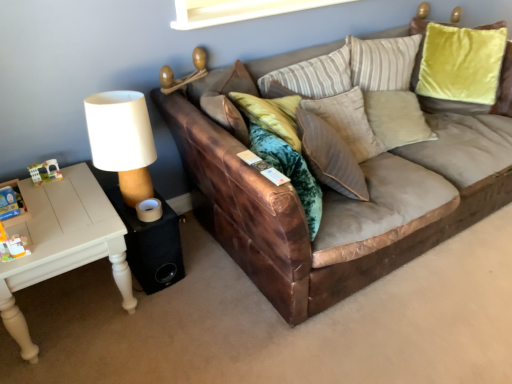
At what (x,y) coordinates should I click in order to perform the action: click on black fabric speaker at lower left. Please return your answer as a coordinate pair (x, y). Image resolution: width=512 pixels, height=384 pixels. Looking at the image, I should click on (151, 244).

Describe the element at coordinates (151, 244) in the screenshot. I see `black fabric speaker at lower left` at that location.

Image resolution: width=512 pixels, height=384 pixels. What do you see at coordinates (62, 243) in the screenshot?
I see `white painted wood table at left` at bounding box center [62, 243].

What is the approximate width of brown leather couch at center?

The width of brown leather couch at center is 1.09 meters.

The height and width of the screenshot is (384, 512). I want to click on black fabric speaker at lower left, so click(151, 244).

From a real-world perspective, is suede-like beige pillow at center located beneath brown leather couch at center?

No, from a real-world perspective, suede-like beige pillow at center is not under brown leather couch at center.

Is suede-like beige pillow at center bigger or smaller than brown leather couch at center?

Considering their sizes, suede-like beige pillow at center takes up less space than brown leather couch at center.

Are suede-like beige pillow at center and brown leather couch at center located far from each other?

They are positioned close to each other.

Locate an element on the screen. The image size is (512, 384). studio couch that appears in front of the suede-like beige pillow at center is located at coordinates (331, 206).

Is black fabric speaker at lower left thinner than white painted wood table at left?

Indeed, black fabric speaker at lower left has a lesser width compared to white painted wood table at left.

Which object is further away from the camera taking this photo, black fabric speaker at lower left or white painted wood table at left?

black fabric speaker at lower left.

From the image's perspective, which one is positioned lower, black fabric speaker at lower left or white painted wood table at left?

From the image's view, white painted wood table at left is below.

Based on the photo, between black fabric speaker at lower left and white painted wood table at left, which one has less height?

With less height is black fabric speaker at lower left.

Is point (301, 124) closer or farther from the camera than point (177, 279)?

Clearly, point (301, 124) is closer to the camera than point (177, 279).

Does suede-like beige pillow at center touch black fabric speaker at lower left?

No, suede-like beige pillow at center is not touching black fabric speaker at lower left.

Is suede-like beige pillow at center positioned with its back to black fabric speaker at lower left?

That's right, suede-like beige pillow at center is facing away from black fabric speaker at lower left.

From a real-world perspective, is suede-like beige pillow at center physically located above or below black fabric speaker at lower left?

Clearly, from a real-world perspective, suede-like beige pillow at center is above black fabric speaker at lower left.

Is suede-like beige pillow at center outside of white painted wood table at left?

That's correct, suede-like beige pillow at center is outside of white painted wood table at left.

Which is more to the right, suede-like beige pillow at center or white painted wood table at left?

suede-like beige pillow at center.

Is suede-like beige pillow at center positioned behind white painted wood table at left?

Yes, suede-like beige pillow at center is behind white painted wood table at left.

Could you tell me if suede-like beige pillow at center is turned towards white painted wood table at left?

No, suede-like beige pillow at center is not facing towards white painted wood table at left.

Is black fabric speaker at lower left surrounded by brown leather couch at center?

No, brown leather couch at center does not contain black fabric speaker at lower left.

Is point (496, 188) behind point (182, 258)?

Yes, point (496, 188) is farther from viewer.

Is brown leather couch at center oriented towards black fabric speaker at lower left?

No, brown leather couch at center is not turned towards black fabric speaker at lower left.

Which object is wider, brown leather couch at center or black fabric speaker at lower left?

With larger width is brown leather couch at center.

From the picture: From the image's perspective, does brown leather couch at center appear higher than suede-like beige pillow at center?

Yes, from the image's perspective, brown leather couch at center is above suede-like beige pillow at center.

Does brown leather couch at center have a greater height compared to suede-like beige pillow at center?

Correct, brown leather couch at center is much taller as suede-like beige pillow at center.

Is brown leather couch at center in contact with suede-like beige pillow at center?

No.

Where is `pillow behind the brown leather couch at center`? The width and height of the screenshot is (512, 384). pillow behind the brown leather couch at center is located at coordinates (330, 157).

Would you say white painted wood table at left is outside brown leather couch at center?

Yes, white painted wood table at left is located beyond the bounds of brown leather couch at center.

Is white painted wood table at left to the right of brown leather couch at center from the viewer's perspective?

In fact, white painted wood table at left is to the left of brown leather couch at center.

Is white painted wood table at left oriented towards brown leather couch at center?

No, white painted wood table at left is not facing towards brown leather couch at center.

Considering the relative sizes of white painted wood table at left and brown leather couch at center in the image provided, is white painted wood table at left smaller than brown leather couch at center?

Yes.

Identify the location of pillow on the left of brown leather couch at center. The height and width of the screenshot is (384, 512). (330, 157).

Locate an element on the screen. The height and width of the screenshot is (384, 512). side table that appears above the white painted wood table at left (from the image's perspective) is located at coordinates (151, 244).

From the image, which object appears to be nearer to black fabric speaker at lower left, white painted wood table at left or suede-like beige pillow at center?

The object closer to black fabric speaker at lower left is white painted wood table at left.

Considering their positions, is white painted wood table at left positioned closer to suede-like beige pillow at center than brown leather couch at center?

brown leather couch at center is closer to suede-like beige pillow at center.

Considering their positions, is suede-like beige pillow at center positioned closer to black fabric speaker at lower left than white painted wood table at left?

Among the two, white painted wood table at left is located nearer to black fabric speaker at lower left.

Considering their positions, is white painted wood table at left positioned closer to suede-like beige pillow at center than black fabric speaker at lower left?

Based on the image, black fabric speaker at lower left appears to be nearer to suede-like beige pillow at center.

When comparing their distances from suede-like beige pillow at center, does brown leather couch at center or white painted wood table at left seem closer?

The object closer to suede-like beige pillow at center is brown leather couch at center.

Based on the photo, considering their positions, is black fabric speaker at lower left positioned closer to white painted wood table at left than brown leather couch at center?

black fabric speaker at lower left lies closer to white painted wood table at left than the other object.

Considering their positions, is white painted wood table at left positioned closer to black fabric speaker at lower left than brown leather couch at center?

white painted wood table at left lies closer to black fabric speaker at lower left than the other object.

Looking at the image, which one is located further to white painted wood table at left, brown leather couch at center or black fabric speaker at lower left?

brown leather couch at center is positioned further to the anchor white painted wood table at left.

Identify the location of side table between white painted wood table at left and suede-like beige pillow at center. (151, 244).

I want to click on pillow between black fabric speaker at lower left and brown leather couch at center, so click(x=330, y=157).

The image size is (512, 384). I want to click on side table between white painted wood table at left and brown leather couch at center in the horizontal direction, so click(x=151, y=244).

Locate an element on the screen. Image resolution: width=512 pixels, height=384 pixels. pillow located between white painted wood table at left and brown leather couch at center in the left-right direction is located at coordinates (330, 157).